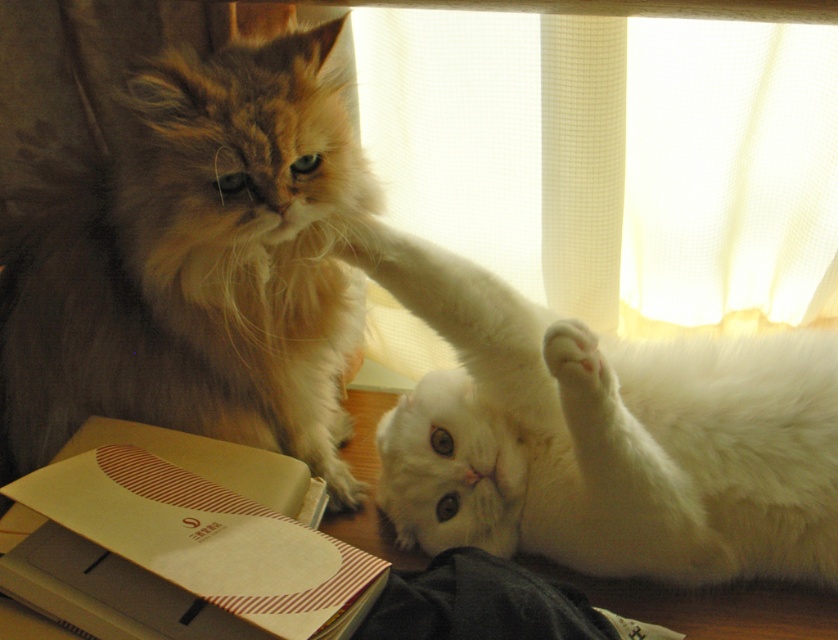
You are trying to determine the relative sizes of the objects in the scene. Given that the fluffy brown cat at left and the white sheer curtain at upper center are both visible, which one appears larger?

The fluffy brown cat at left appears larger than the white sheer curtain at upper center.

You are a cat owner trying to decide where to place a new scratching post. You have two options in the image. The first is near the fluffy brown cat at left, and the second is near the white sheer curtain at upper center. Which location would be closer to the cat if you want it to be easily accessible?

The fluffy brown cat at left is to the left of the white sheer curtain at upper center, so placing the scratching post near the fluffy brown cat at left would be closer to the cat.